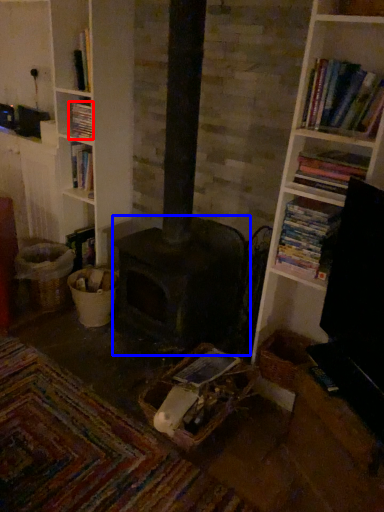
Question: Among these objects, which one is nearest to the camera, book (highlighted by a red box) or heater (highlighted by a blue box)?

Choices:
 (A) book
 (B) heater

Answer: (B)